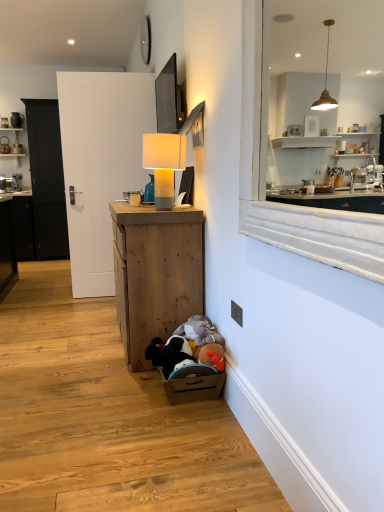
Question: Looking at the image, does black plastic electric outlet at lower right seem bigger or smaller compared to matte gray table lamp at center?

Choices:
 (A) small
 (B) big

Answer: (A)

Question: From a real-world perspective, relative to matte gray table lamp at center, is black plastic electric outlet at lower right vertically above or below?

Choices:
 (A) below
 (B) above

Answer: (A)

Question: Estimate the real-world distances between objects in this image. Which object is closer to the black plastic electric outlet at lower right?

Choices:
 (A) matte gray table lamp at center
 (B) white wooden door at center
 (C) wooden cabinet at lower center
 (D) white marble window at upper right

Answer: (C)

Question: Estimate the real-world distances between objects in this image. Which object is closer to the wooden cabinet at lower center?

Choices:
 (A) black plastic electric outlet at lower right
 (B) white marble window at upper right
 (C) white wooden door at center
 (D) matte gray table lamp at center

Answer: (D)